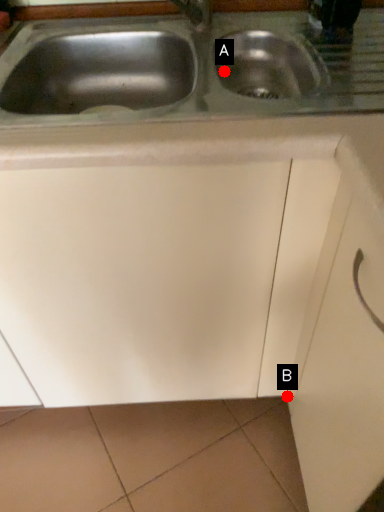
Question: Two points are circled on the image, labeled by A and B beside each circle. Which of the following is the farthest from the observer?

Choices:
 (A) A is further
 (B) B is further

Answer: (B)